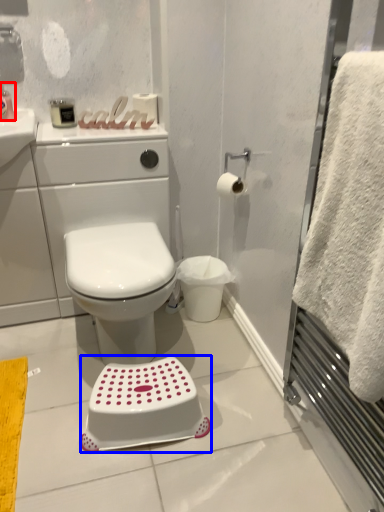
Question: Which of the following is the farthest to the observer, toiletry (highlighted by a red box) or step stool (highlighted by a blue box)?

Choices:
 (A) toiletry
 (B) step stool

Answer: (A)